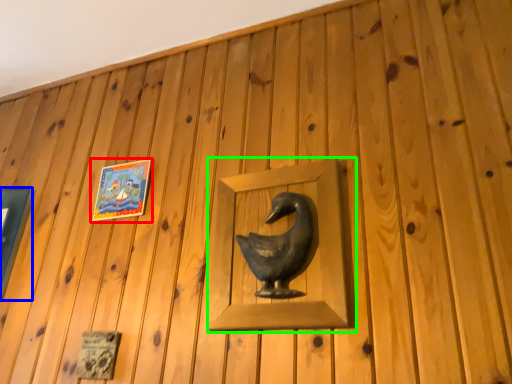
Question: Estimate the real-world distances between objects in this image. Which object is farther from picture frame (highlighted by a red box), picture frame (highlighted by a blue box) or sculpture (highlighted by a green box)?

Choices:
 (A) picture frame
 (B) sculpture

Answer: (B)